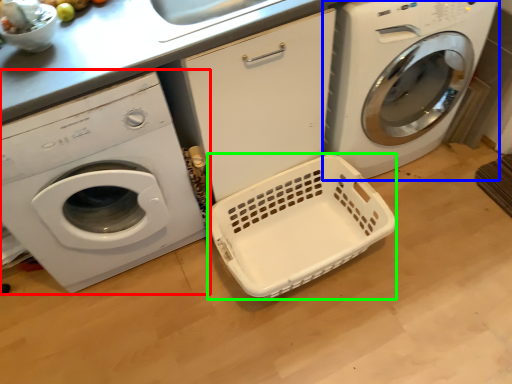
Question: Which is farther away from washing machine (highlighted by a red box)? washing machine (highlighted by a blue box) or basket container (highlighted by a green box)?

Choices:
 (A) washing machine
 (B) basket container

Answer: (A)